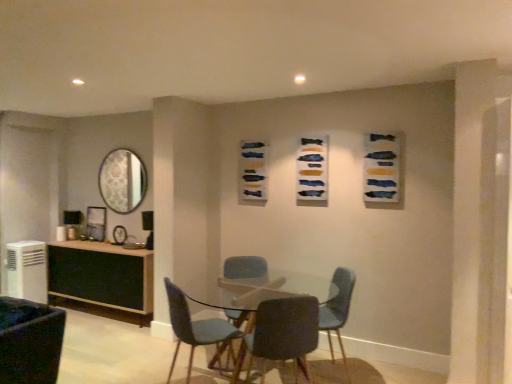
Image resolution: width=512 pixels, height=384 pixels. I want to click on vacant position to the left of clear glass table at center, so click(152, 362).